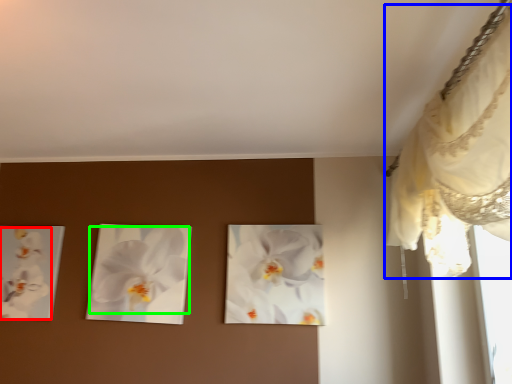
Question: Which object is positioned farthest from flower (highlighted by a red box)? Select from curtain (highlighted by a blue box) and flower (highlighted by a green box).

Choices:
 (A) curtain
 (B) flower

Answer: (A)